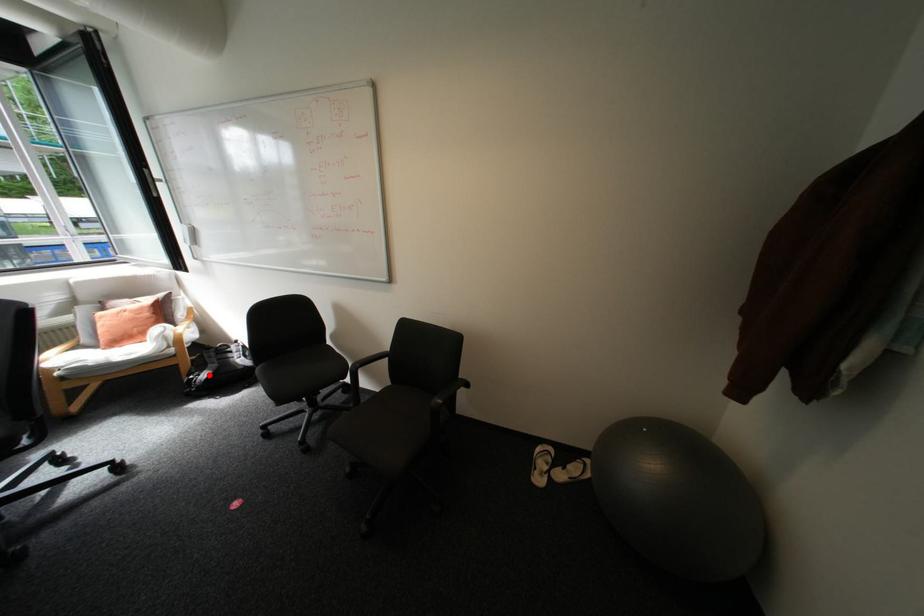
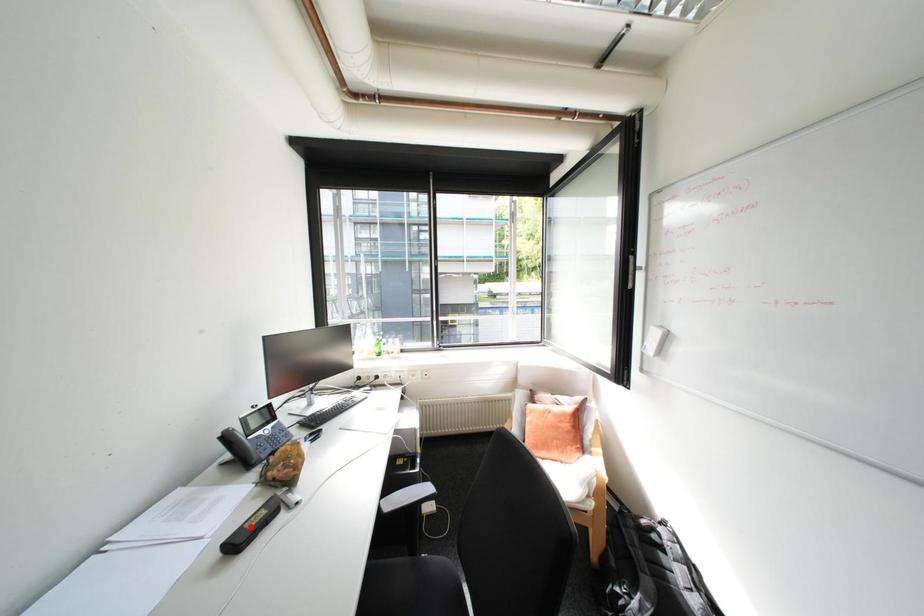
I am providing you with two images of the same scene from different viewpoints. A red point is marked on the first image and another point is marked on the second image. Is the red point in image1 aligned with the point shown in image2?

No